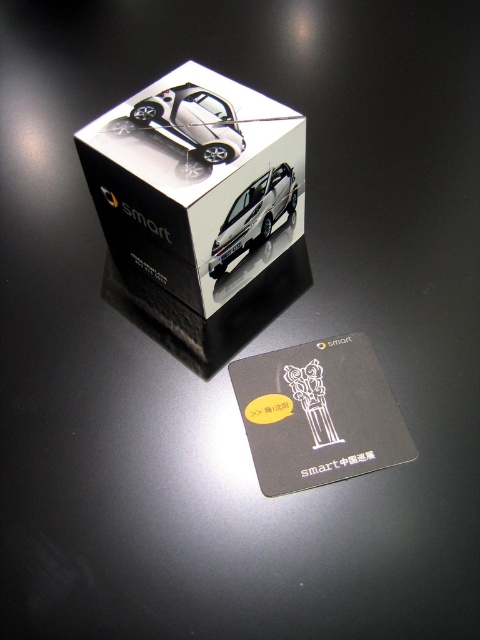
Question: Does satin silver car at center have a smaller size compared to satin silver metallic car at center?

Choices:
 (A) yes
 (B) no

Answer: (A)

Question: Can you confirm if white glossy car at center is thinner than satin silver car at center?

Choices:
 (A) no
 (B) yes

Answer: (A)

Question: Which point is closer to the camera?

Choices:
 (A) white glossy car at center
 (B) satin silver car at center

Answer: (A)

Question: Is white glossy car at center bigger than satin silver car at center?

Choices:
 (A) no
 (B) yes

Answer: (B)

Question: Which point appears closest to the camera in this image?

Choices:
 (A) (230, 253)
 (B) (204, 124)

Answer: (B)

Question: Based on their relative distances, which object is nearer to the satin silver car at center?

Choices:
 (A) white glossy car at center
 (B) satin silver metallic car at center
 (C) black matte business card at lower center

Answer: (A)